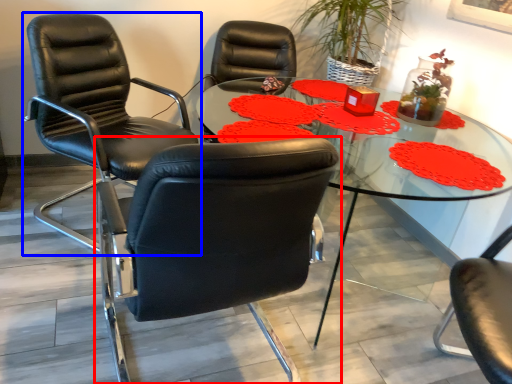
Question: Among these objects, which one is nearest to the camera, chair (highlighted by a red box) or chair (highlighted by a blue box)?

Choices:
 (A) chair
 (B) chair

Answer: (A)